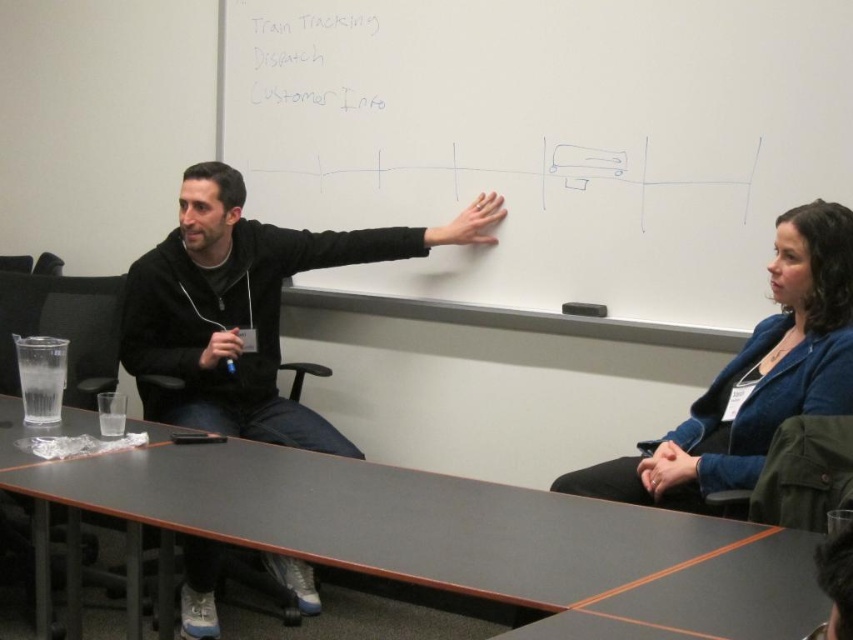
Question: In this image, where is smooth black table at center located relative to blue fabric jacket at upper right?

Choices:
 (A) below
 (B) above

Answer: (A)

Question: Which object is closer to the camera taking this photo?

Choices:
 (A) blue fabric jacket at upper right
 (B) white matte board at center
 (C) black matte hoodie at upper left
 (D) smooth black table at center

Answer: (D)

Question: Which point is farther from the camera taking this photo?

Choices:
 (A) (686, 518)
 (B) (706, 17)

Answer: (B)

Question: Can you confirm if white matte board at center is positioned to the left of black matte hoodie at upper left?

Choices:
 (A) yes
 (B) no

Answer: (B)

Question: Which point is closer to the camera?

Choices:
 (A) (698, 497)
 (B) (236, 330)
 (C) (619, 316)

Answer: (A)

Question: Does smooth black table at center lie in front of blue fabric jacket at upper right?

Choices:
 (A) no
 (B) yes

Answer: (B)